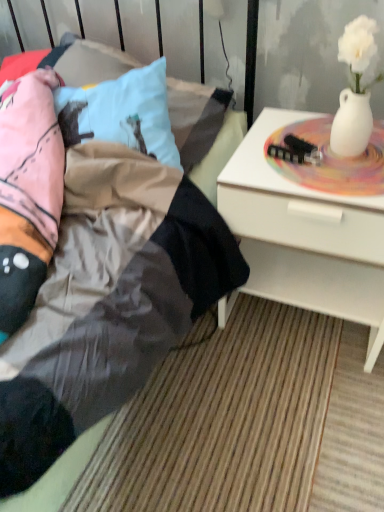
This screenshot has width=384, height=512. What are the coordinates of `space that is in front of white glossy desk at upper right` in the screenshot? It's located at (292, 418).